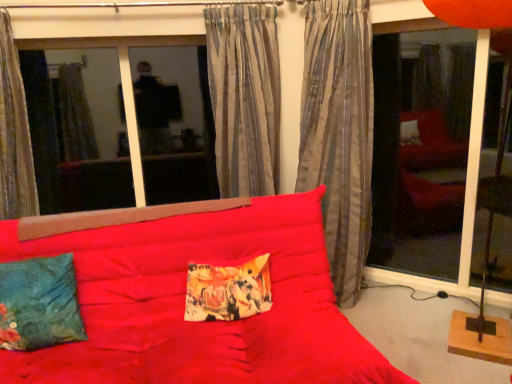
Question: Does striped fabric curtain at left, which appears as the 3th curtain when viewed from the right, turn towards matte red studio couch at center?

Choices:
 (A) yes
 (B) no

Answer: (B)

Question: Is striped fabric curtain at left, the 1th curtain when ordered from left to right, placed right next to matte red studio couch at center?

Choices:
 (A) yes
 (B) no

Answer: (B)

Question: Can you confirm if striped fabric curtain at left, which appears as the 3th curtain when viewed from the right, is taller than matte red studio couch at center?

Choices:
 (A) no
 (B) yes

Answer: (B)

Question: Can you confirm if striped fabric curtain at left, which appears as the 3th curtain when viewed from the right, is thinner than matte red studio couch at center?

Choices:
 (A) no
 (B) yes

Answer: (B)

Question: Can you confirm if striped fabric curtain at left, the 1th curtain when ordered from left to right, is smaller than matte red studio couch at center?

Choices:
 (A) no
 (B) yes

Answer: (B)

Question: From the image's perspective, is striped fabric curtain at left, which appears as the 3th curtain when viewed from the right, on matte red studio couch at center?

Choices:
 (A) no
 (B) yes

Answer: (B)

Question: Are silky gray curtain at center, positioned as the first curtain in right-to-left order, and transparent glass door at right far apart?

Choices:
 (A) yes
 (B) no

Answer: (B)

Question: Considering the relative positions of silky gray curtain at center, positioned as the first curtain in right-to-left order, and transparent glass door at right in the image provided, is silky gray curtain at center, positioned as the first curtain in right-to-left order, to the left of transparent glass door at right from the viewer's perspective?

Choices:
 (A) no
 (B) yes

Answer: (B)

Question: Can you confirm if silky gray curtain at center, positioned as the first curtain in right-to-left order, is wider than transparent glass door at right?

Choices:
 (A) yes
 (B) no

Answer: (A)

Question: Is silky gray curtain at center, positioned as the 3th curtain in left-to-right order, facing towards transparent glass door at right?

Choices:
 (A) yes
 (B) no

Answer: (B)

Question: Considering the relative sizes of silky gray curtain at center, positioned as the 3th curtain in left-to-right order, and transparent glass door at right in the image provided, is silky gray curtain at center, positioned as the 3th curtain in left-to-right order, shorter than transparent glass door at right?

Choices:
 (A) yes
 (B) no

Answer: (B)

Question: From the image's perspective, is silky gray curtain at center, positioned as the 3th curtain in left-to-right order, above transparent glass door at right?

Choices:
 (A) yes
 (B) no

Answer: (A)

Question: Is striped fabric curtain at center, which is counted as the 2th curtain, starting from the left, to the left of striped fabric curtain at left, which appears as the 3th curtain when viewed from the right, from the viewer's perspective?

Choices:
 (A) no
 (B) yes

Answer: (A)